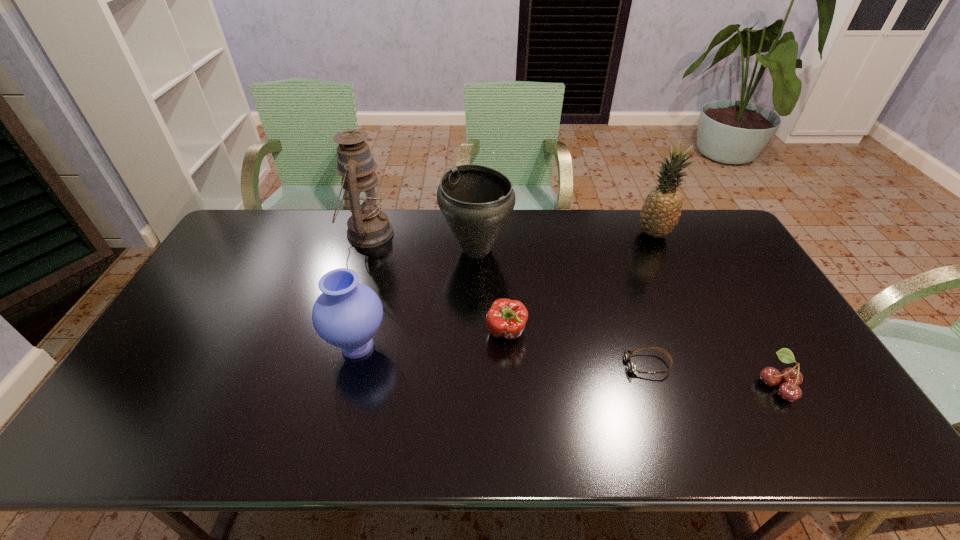
You are a GUI agent. You are given a task and a screenshot of the screen. Output one action in this format:
    pyautogui.click(x=<x>, y=<y>)
    Task: Click on the vacant space in between the sixth object from left to right and the third object from right to left
    The image size is (960, 540).
    Given the screenshot: What is the action you would take?
    pyautogui.click(x=651, y=299)

Image resolution: width=960 pixels, height=540 pixels. What are the coordinates of `unoccupied position between the shortest object and the urn` in the screenshot? It's located at (562, 307).

Identify the location of vacant space that is in between the urn and the vase. This screenshot has width=960, height=540. 417,298.

The height and width of the screenshot is (540, 960). In order to click on free spot between the sixth object from left to right and the pepper in this screenshot , I will do `click(580, 283)`.

You are a GUI agent. You are given a task and a screenshot of the screen. Output one action in this format:
    pyautogui.click(x=<x>, y=<y>)
    Task: Click on the vacant space that is in between the pineapple and the urn
    
    Given the screenshot: What is the action you would take?
    pyautogui.click(x=564, y=241)

This screenshot has width=960, height=540. Identify the location of vacant area that lies between the pepper and the second object from right to left. (580, 283).

Where is `empty space that is in between the oil lamp and the pineapple`? empty space that is in between the oil lamp and the pineapple is located at coordinates (511, 233).

Where is `free space between the urn and the vase`? The image size is (960, 540). free space between the urn and the vase is located at coordinates (417, 298).

Identify which object is the third nearest to the shortest object. Please provide its 2D coordinates. Your answer should be formatted as a tuple, i.e. [(x, y)], where the tuple contains the x and y coordinates of a point satisfying the conditions above.

[(476, 201)]

Identify which object is located as the sixth nearest to the oil lamp. Please provide its 2D coordinates. Your answer should be formatted as a tuple, i.e. [(x, y)], where the tuple contains the x and y coordinates of a point satisfying the conditions above.

[(791, 378)]